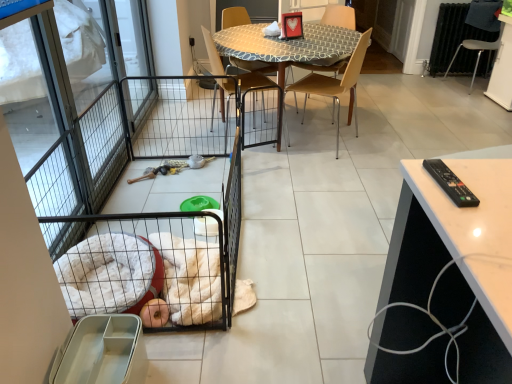
Describe the element at coordinates (290, 45) in the screenshot. This screenshot has width=512, height=384. I see `patterned fabric table at center` at that location.

The image size is (512, 384). I want to click on wooden chair at center, the second chair viewed from the right, so click(x=339, y=16).

Measure the distance between point (178, 312) and camera.

They are 5.77 feet apart.

Locate an element on the screen. Image resolution: width=512 pixels, height=384 pixels. white glossy table at right is located at coordinates (445, 225).

How much space does metallic silver chair at right, the first chair when ordered from right to left, occupy horizontally?

56.08 centimeters.

Find the location of a particular element. metallic screen door at left is located at coordinates (82, 160).

Is patterned fabric table at center bigger than wooden chair at center, positioned as the first chair in left-to-right order?

Yes, patterned fabric table at center is bigger than wooden chair at center, positioned as the first chair in left-to-right order.

Is point (316, 55) closer or farther from the camera than point (254, 100)?

Point (316, 55) appears to be closer to the viewer than point (254, 100).

Is patterned fabric table at center oriented towards wooden chair at center, which is the fourth chair in right-to-left order?

No, patterned fabric table at center is not oriented towards wooden chair at center, which is the fourth chair in right-to-left order.

In the scene shown: Is patterned fabric table at center not close to wooden chair at center, positioned as the first chair in left-to-right order?

They are positioned close to each other.

In the image, is white glossy table at right on the left side or the right side of light brown plastic chair at center, the 3th chair when ordered from right to left?

Based on their positions, white glossy table at right is located to the right of light brown plastic chair at center, the 3th chair when ordered from right to left.

Is the depth of white glossy table at right greater than that of light brown plastic chair at center, the 3th chair when ordered from right to left?

No, white glossy table at right is closer to the camera.

Does white glossy table at right have a larger size compared to light brown plastic chair at center, which appears as the second chair when viewed from the left?

Correct, white glossy table at right is larger in size than light brown plastic chair at center, which appears as the second chair when viewed from the left.

Would you say white glossy table at right is a long distance from light brown plastic chair at center, which appears as the second chair when viewed from the left?

Yes, white glossy table at right is far from light brown plastic chair at center, which appears as the second chair when viewed from the left.

From the image's perspective, is black wire pet cage at left positioned above or below wooden chair at center, which is counted as the 3th chair, starting from the left?

Clearly, from the image's perspective, black wire pet cage at left is below wooden chair at center, which is counted as the 3th chair, starting from the left.

Is black wire pet cage at left closer to camera compared to wooden chair at center, which is counted as the 3th chair, starting from the left?

Yes, black wire pet cage at left is in front of wooden chair at center, which is counted as the 3th chair, starting from the left.

Visually, is black wire pet cage at left positioned to the left or to the right of wooden chair at center, the second chair viewed from the right?

black wire pet cage at left is positioned on wooden chair at center, the second chair viewed from the right,'s left side.

Which is behind, point (177, 77) or point (486, 238)?

The point (177, 77) is farther.

Considering the positions of objects black wire pet cage at left and white glossy table at right in the image provided, who is more to the right, black wire pet cage at left or white glossy table at right?

white glossy table at right is more to the right.

Locate an element on the screen. balcony that appears on the left of white glossy table at right is located at coordinates (151, 259).

Is metallic screen door at left inside the boundaries of patterned fabric table at center, or outside?

metallic screen door at left lies outside patterned fabric table at center.

Is patterned fabric table at center at the back of metallic screen door at left?

No.

Locate an element on the screen. Image resolution: width=512 pixels, height=384 pixels. kitchen & dining room table behind the metallic screen door at left is located at coordinates (290, 45).

How distant is metallic screen door at left from patterned fabric table at center?

metallic screen door at left is 4.14 feet from patterned fabric table at center.

Could you tell me if black wire pet cage at left is turned towards metallic screen door at left?

No, black wire pet cage at left is not oriented towards metallic screen door at left.

Is black wire pet cage at left in front of or behind metallic screen door at left in the image?

black wire pet cage at left is positioned farther from the viewer than metallic screen door at left.

From a real-world perspective, is black wire pet cage at left on top of metallic screen door at left?

Incorrect, from a real-world perspective, black wire pet cage at left is lower than metallic screen door at left.

Is point (174, 83) farther from camera compared to point (98, 30)?

That is True.

Is white glossy table at right with wooden chair at center, which is counted as the 3th chair, starting from the left?

white glossy table at right and wooden chair at center, which is counted as the 3th chair, starting from the left, are not in contact.

Is white glossy table at right in front of or behind wooden chair at center, which is counted as the 3th chair, starting from the left, in the image?

Clearly, white glossy table at right is in front of wooden chair at center, which is counted as the 3th chair, starting from the left.

Looking at this image, is wooden chair at center, which is counted as the 3th chair, starting from the left, located within white glossy table at right?

No, wooden chair at center, which is counted as the 3th chair, starting from the left, is located outside of white glossy table at right.

Does white glossy table at right have a lesser width compared to wooden chair at center, the second chair viewed from the right?

In fact, white glossy table at right might be wider than wooden chair at center, the second chair viewed from the right.

You are a GUI agent. You are given a task and a screenshot of the screen. Output one action in this format:
    pyautogui.click(x=<x>, y=<y>)
    Task: Click on the 1st chair in front of the patterned fabric table at center
    
    Given the screenshot: What is the action you would take?
    pyautogui.click(x=212, y=53)

This screenshot has height=384, width=512. I want to click on cabinetry to the right of light brown plastic chair at center, the 3th chair when ordered from right to left, so click(x=445, y=225).

When comparing their distances from metallic silver chair at right, the first chair when ordered from right to left, does light brown plastic chair at center, which appears as the second chair when viewed from the left, or patterned fabric table at center seem further?

patterned fabric table at center is further to metallic silver chair at right, the first chair when ordered from right to left.

Based on their spatial positions, is metallic silver chair at right, the first chair when ordered from right to left, or wooden chair at center, which is the fourth chair in right-to-left order, further from black wire pet cage at left?

metallic silver chair at right, the first chair when ordered from right to left.

From the image, which object appears to be farther from metallic screen door at left, wooden chair at center, positioned as the first chair in left-to-right order, or white glossy table at right?

white glossy table at right is further to metallic screen door at left.

Looking at this image, looking at the image, which one is located further to light brown plastic chair at center, which appears as the second chair when viewed from the left, patterned fabric table at center or white glossy table at right?

The object further to light brown plastic chair at center, which appears as the second chair when viewed from the left, is white glossy table at right.

Considering their positions, is light brown plastic chair at center, which appears as the second chair when viewed from the left, positioned closer to black wire pet cage at left than white glossy table at right?

The object closer to black wire pet cage at left is white glossy table at right.

Based on their spatial positions, is metallic screen door at left or metallic silver chair at right, the first chair when ordered from right to left, closer to white glossy table at right?

metallic screen door at left is positioned closer to the anchor white glossy table at right.

When comparing their distances from metallic screen door at left, does wooden chair at center, the second chair viewed from the right, or patterned fabric table at center seem further?

wooden chair at center, the second chair viewed from the right, lies further to metallic screen door at left than the other object.

From the image, which object appears to be nearer to patterned fabric table at center, metallic silver chair at right, positioned as the 4th chair in left-to-right order, or wooden chair at center, which is counted as the 3th chair, starting from the left?

wooden chair at center, which is counted as the 3th chair, starting from the left, is closer to patterned fabric table at center.

Where is `kitchen & dining room table between black wire pet cage at left and wooden chair at center, which is counted as the 3th chair, starting from the left, along the z-axis`? The width and height of the screenshot is (512, 384). kitchen & dining room table between black wire pet cage at left and wooden chair at center, which is counted as the 3th chair, starting from the left, along the z-axis is located at coordinates (290, 45).

Locate an element on the screen. The image size is (512, 384). chair between metallic screen door at left and light brown plastic chair at center, the 3th chair when ordered from right to left is located at coordinates (212, 53).

You are a GUI agent. You are given a task and a screenshot of the screen. Output one action in this format:
    pyautogui.click(x=<x>, y=<y>)
    Task: Click on the balcony located between metallic screen door at left and light brown plastic chair at center, which appears as the second chair when viewed from the left, in the left-right direction
    This screenshot has height=384, width=512.
    Given the screenshot: What is the action you would take?
    pyautogui.click(x=151, y=259)

At what (x,y) coordinates should I click in order to perform the action: click on kitchen & dining room table between metallic screen door at left and metallic silver chair at right, positioned as the 4th chair in left-to-right order, in the horizontal direction. Please return your answer as a coordinate pair (x, y). The image size is (512, 384). Looking at the image, I should click on (290, 45).